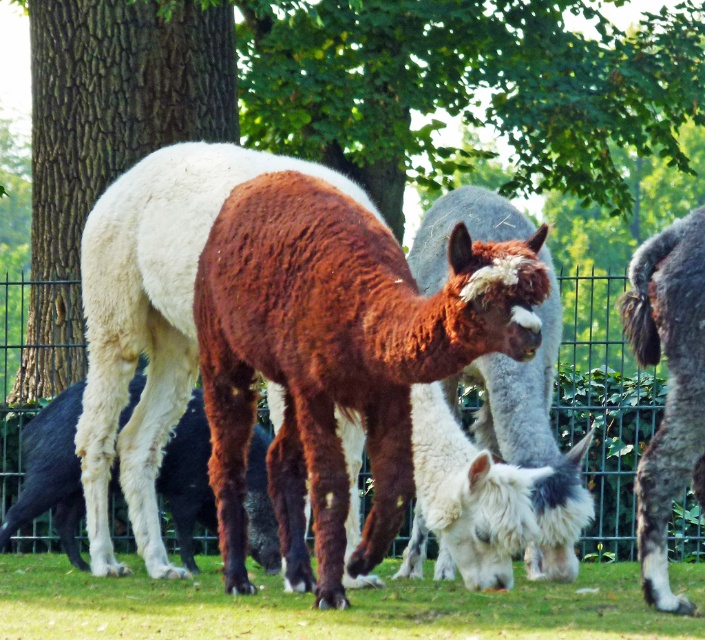
You are standing at the point labeled as point (106, 138) in the image. What object is located at that point?

The point (106, 138) corresponds to the brown textured tree trunk at upper left.

You are a gardener who wants to plant a new flower bed between the brown textured tree trunk at upper left and the green grass at lower center. Considering their heights, which object will block sunlight to the flowers more?

The brown textured tree trunk at upper left is much taller than the green grass at lower center, so it will block more sunlight to the flowers.